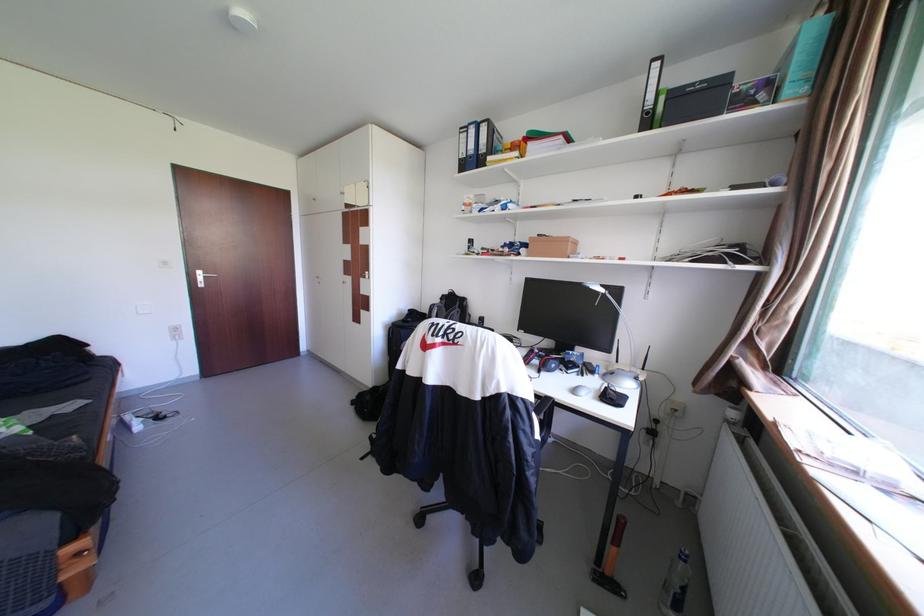
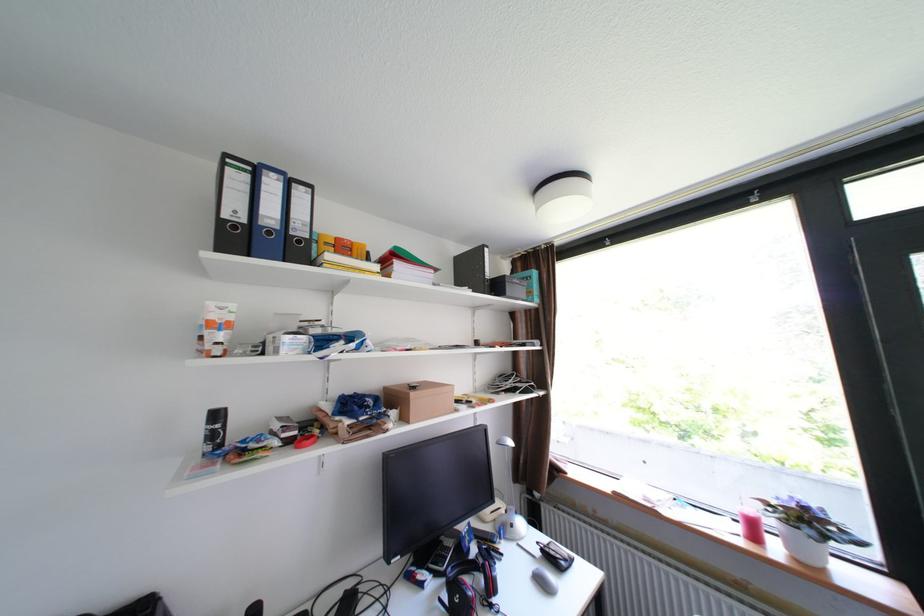
The point at (469,160) is marked in the first image. Where is the corresponding point in the second image?

(232, 221)